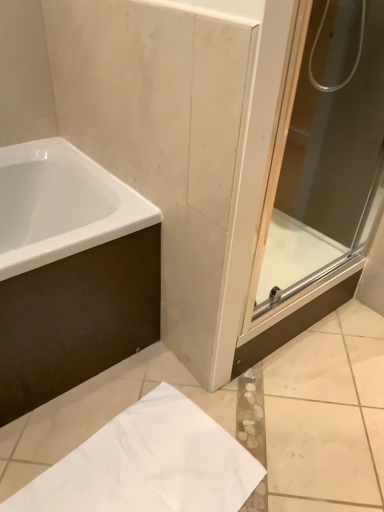
Find the location of `transparent glass shower door at right`. transparent glass shower door at right is located at coordinates (321, 161).

What is the approximate height of transparent glass shower door at right?

transparent glass shower door at right is 38.88 inches tall.

Image resolution: width=384 pixels, height=512 pixels. Find the location of `transparent glass shower door at right`. transparent glass shower door at right is located at coordinates (321, 161).

Would you say white matte paper at lower center is a long distance from transparent glass shower door at right?

white matte paper at lower center is actually quite close to transparent glass shower door at right.

Is point (49, 498) farther from camera compared to point (337, 45)?

No, (49, 498) is closer to viewer.

Considering the relative sizes of white matte paper at lower center and transparent glass shower door at right in the image provided, is white matte paper at lower center bigger than transparent glass shower door at right?

No.

From the image's perspective, is white matte paper at lower center on top of transparent glass shower door at right?

Incorrect, from the image's perspective, white matte paper at lower center is lower than transparent glass shower door at right.

Can you tell me how much transparent glass shower door at right and white glossy bathtub at upper left differ in facing direction?

The angular difference between transparent glass shower door at right and white glossy bathtub at upper left is 0.00318 degrees.

Which is more to the right, transparent glass shower door at right or white glossy bathtub at upper left?

transparent glass shower door at right is more to the right.

Is point (321, 60) farther from camera compared to point (117, 279)?

Yes, point (321, 60) is behind point (117, 279).

Based on the photo, between transparent glass shower door at right and white glossy bathtub at upper left, which one has larger size?

white glossy bathtub at upper left.

From the image's perspective, is transparent glass shower door at right below white matte paper at lower center?

Actually, transparent glass shower door at right appears above white matte paper at lower center in the image.

Considering the positions of points (310, 185) and (140, 431), is point (310, 185) closer to camera compared to point (140, 431)?

No, (310, 185) is behind (140, 431).

Considering the relative positions of transparent glass shower door at right and white matte paper at lower center in the image provided, is transparent glass shower door at right to the right of white matte paper at lower center from the viewer's perspective?

Correct, you'll find transparent glass shower door at right to the right of white matte paper at lower center.

Based on their sizes in the image, would you say transparent glass shower door at right is bigger or smaller than white matte paper at lower center?

transparent glass shower door at right is bigger than white matte paper at lower center.

Is white glossy bathtub at upper left closer to camera compared to white matte paper at lower center?

No, it is behind white matte paper at lower center.

Is white glossy bathtub at upper left bigger or smaller than white matte paper at lower center?

In the image, white glossy bathtub at upper left appears to be larger than white matte paper at lower center.

Is white glossy bathtub at upper left far away from white matte paper at lower center?

No, white glossy bathtub at upper left is in close proximity to white matte paper at lower center.

What are the coordinates of `bathtub located behind the white matte paper at lower center` in the screenshot? It's located at (70, 272).

Considering the sizes of white matte paper at lower center and white glossy bathtub at upper left in the image, is white matte paper at lower center taller or shorter than white glossy bathtub at upper left?

In the image, white matte paper at lower center appears to be shorter than white glossy bathtub at upper left.

Could you tell me if white matte paper at lower center is turned towards white glossy bathtub at upper left?

No, white matte paper at lower center is not facing towards white glossy bathtub at upper left.

Between white matte paper at lower center and white glossy bathtub at upper left, which one has smaller width?

white matte paper at lower center.

Is white matte paper at lower center bigger than white glossy bathtub at upper left?

No.

Does point (40, 354) lie in front of point (302, 247)?

Yes.

From a real-world perspective, which object stands above the other?

transparent glass shower door at right, from a real-world perspective.

Is white glossy bathtub at upper left outside of transparent glass shower door at right?

Yes, white glossy bathtub at upper left is outside of transparent glass shower door at right.

This screenshot has width=384, height=512. I want to click on screen door above the white matte paper at lower center (from a real-world perspective), so click(321, 161).

Where is `screen door in front of the white glossy bathtub at upper left`? This screenshot has width=384, height=512. screen door in front of the white glossy bathtub at upper left is located at coordinates (321, 161).

Considering their positions, is transparent glass shower door at right positioned further to white glossy bathtub at upper left than white matte paper at lower center?

transparent glass shower door at right.

From the image, which object appears to be nearer to transparent glass shower door at right, white glossy bathtub at upper left or white matte paper at lower center?

white glossy bathtub at upper left is positioned closer to the anchor transparent glass shower door at right.

Looking at the image, which one is located closer to white matte paper at lower center, white glossy bathtub at upper left or transparent glass shower door at right?

The object closer to white matte paper at lower center is white glossy bathtub at upper left.

Based on their spatial positions, is white matte paper at lower center or white glossy bathtub at upper left further from transparent glass shower door at right?

The object further to transparent glass shower door at right is white matte paper at lower center.

When comparing their distances from white matte paper at lower center, does transparent glass shower door at right or white glossy bathtub at upper left seem closer?

white glossy bathtub at upper left is positioned closer to the anchor white matte paper at lower center.

Based on their spatial positions, is white matte paper at lower center or transparent glass shower door at right closer to white glossy bathtub at upper left?

Based on the image, white matte paper at lower center appears to be nearer to white glossy bathtub at upper left.

I want to click on paper between white glossy bathtub at upper left and transparent glass shower door at right from left to right, so click(x=148, y=464).